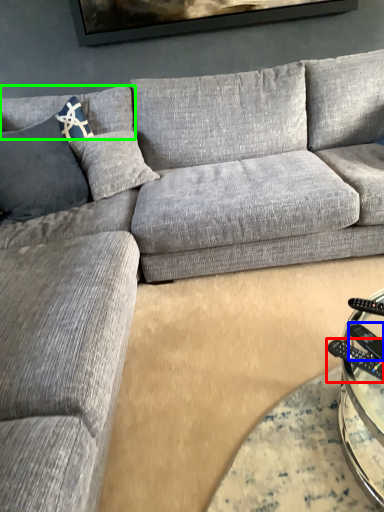
Question: Which object is the closest to the control (highlighted by a red box)? Choose among these: remote (highlighted by a blue box) or pillow (highlighted by a green box).

Choices:
 (A) remote
 (B) pillow

Answer: (A)